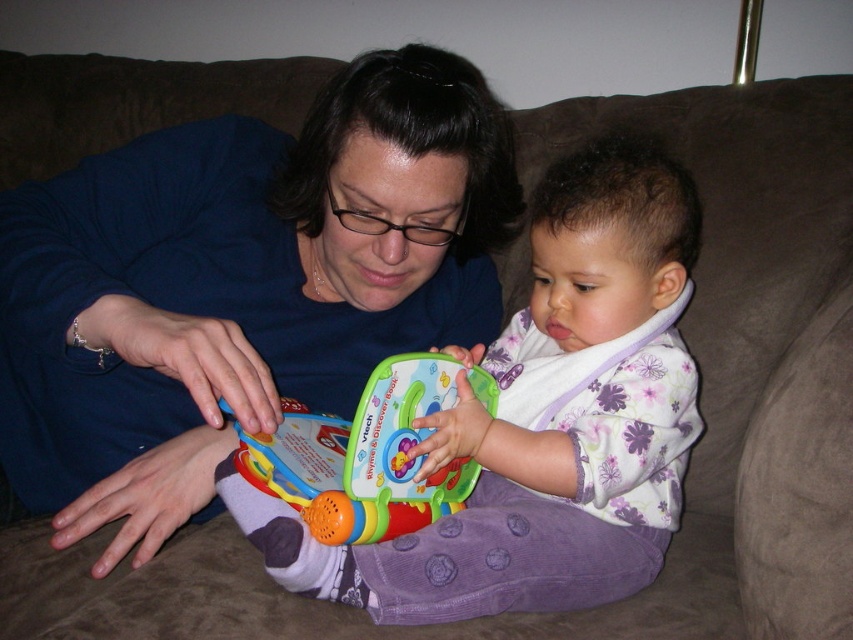
Does blue fabric at center appear on the right side of floral jersey at center?

In fact, blue fabric at center is to the left of floral jersey at center.

The height and width of the screenshot is (640, 853). Identify the location of blue fabric at center. (241, 284).

You are a GUI agent. You are given a task and a screenshot of the screen. Output one action in this format:
    pyautogui.click(x=<x>, y=<y>)
    Task: Click on the blue fabric at center
    Image resolution: width=853 pixels, height=640 pixels.
    Given the screenshot: What is the action you would take?
    pyautogui.click(x=241, y=284)

Can you confirm if floral jersey at center is positioned above multicolored plastic toy at center?

Yes.

The height and width of the screenshot is (640, 853). I want to click on floral jersey at center, so click(x=544, y=420).

Does blue fabric at center have a smaller size compared to multicolored plastic toy at center?

No, blue fabric at center is not smaller than multicolored plastic toy at center.

Who is positioned more to the left, blue fabric at center or multicolored plastic toy at center?

From the viewer's perspective, blue fabric at center appears more on the left side.

This screenshot has width=853, height=640. Find the location of `blue fabric at center`. blue fabric at center is located at coordinates (241, 284).

Where is `blue fabric at center`? This screenshot has height=640, width=853. blue fabric at center is located at coordinates (241, 284).